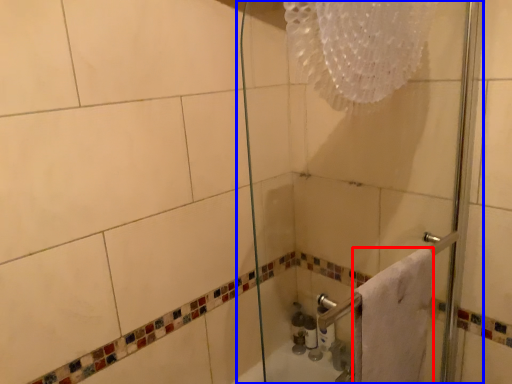
Question: Which object appears closest to the camera in this image, towel (highlighted by a red box) or shower door (highlighted by a blue box)?

Choices:
 (A) towel
 (B) shower door

Answer: (B)